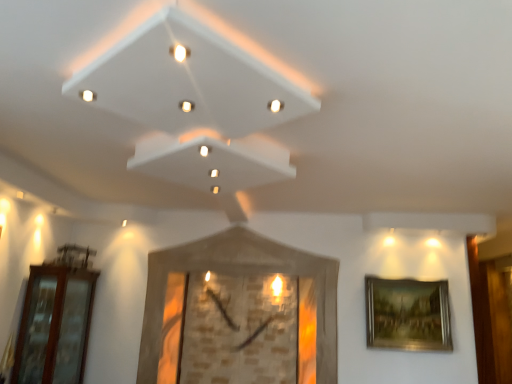
Question: From a real-world perspective, is brown glass door at left beneath gold metallic picture frame at right, placed as the 2th picture frame when sorted from left to right?

Choices:
 (A) no
 (B) yes

Answer: (B)

Question: Can you confirm if brown glass door at left is positioned to the left of gold metallic picture frame at right, the first picture frame viewed from the right?

Choices:
 (A) yes
 (B) no

Answer: (A)

Question: Is gold metallic picture frame at right, placed as the 2th picture frame when sorted from left to right, located within brown glass door at left?

Choices:
 (A) yes
 (B) no

Answer: (B)

Question: From a real-world perspective, is brown glass door at left physically above gold metallic picture frame at right, the first picture frame viewed from the right?

Choices:
 (A) no
 (B) yes

Answer: (A)

Question: Is brown glass door at left smaller than gold metallic picture frame at right, placed as the 2th picture frame when sorted from left to right?

Choices:
 (A) no
 (B) yes

Answer: (A)

Question: Is brown glass door at left at the right side of gold metallic picture frame at right, placed as the 2th picture frame when sorted from left to right?

Choices:
 (A) yes
 (B) no

Answer: (B)

Question: Are brown glass door at left and wooden clock at center, the 2th picture frame positioned from the right, far apart?

Choices:
 (A) yes
 (B) no

Answer: (A)

Question: Is brown glass door at left not inside wooden clock at center, the first picture frame in the left-to-right sequence?

Choices:
 (A) yes
 (B) no

Answer: (A)

Question: From a real-world perspective, is brown glass door at left positioned under wooden clock at center, the 2th picture frame positioned from the right, based on gravity?

Choices:
 (A) no
 (B) yes

Answer: (B)

Question: Is wooden clock at center, the 2th picture frame positioned from the right, completely or partially inside brown glass door at left?

Choices:
 (A) yes
 (B) no

Answer: (B)

Question: Does brown glass door at left lie behind wooden clock at center, the first picture frame in the left-to-right sequence?

Choices:
 (A) no
 (B) yes

Answer: (A)

Question: Does brown glass door at left have a lesser height compared to wooden clock at center, the first picture frame in the left-to-right sequence?

Choices:
 (A) no
 (B) yes

Answer: (B)

Question: Is gold metallic picture frame at right, the first picture frame viewed from the right, at the back of wooden clock at center, the 2th picture frame positioned from the right?

Choices:
 (A) no
 (B) yes

Answer: (A)